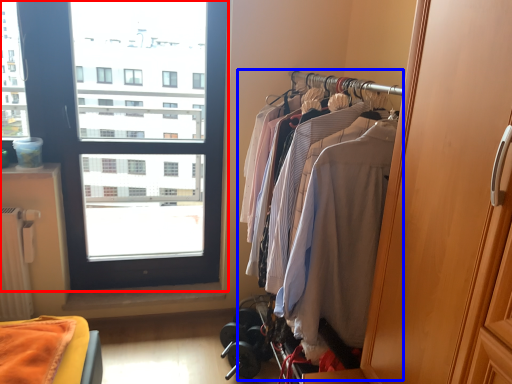
Question: Among these objects, which one is nearest to the camera, window (highlighted by a red box) or closet (highlighted by a blue box)?

Choices:
 (A) window
 (B) closet

Answer: (B)